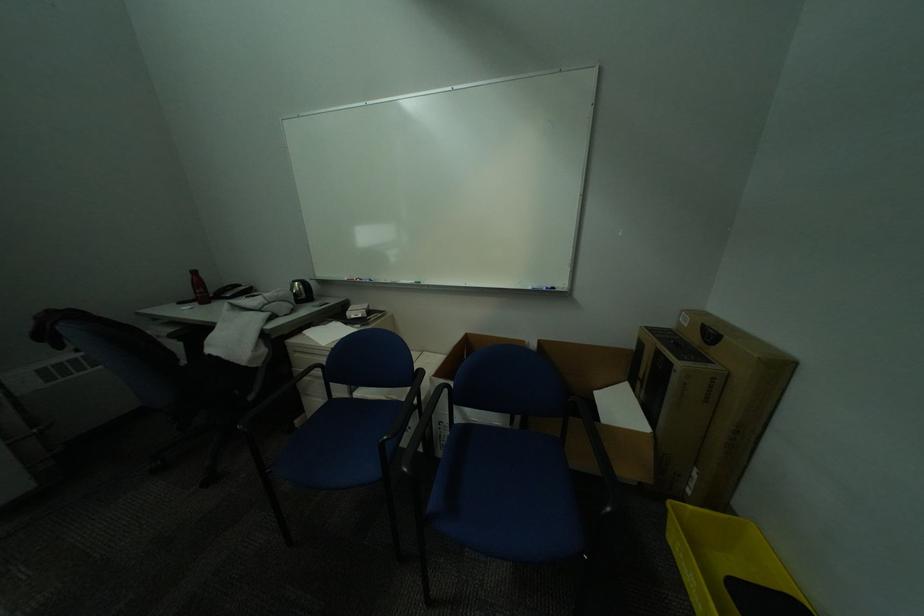
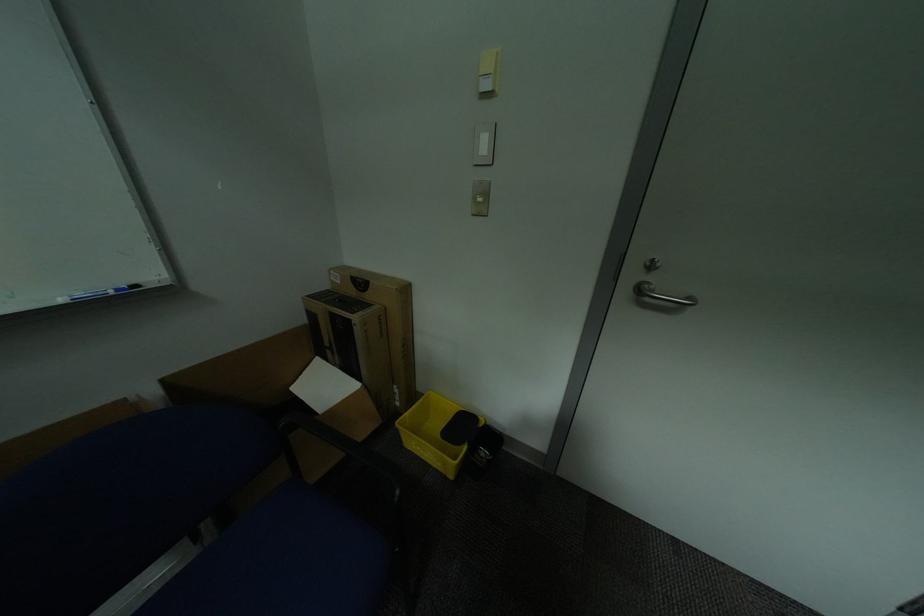
Consider the image. Based on the continuous images, in which direction is the camera rotating?

The camera's rotation is toward right-down.